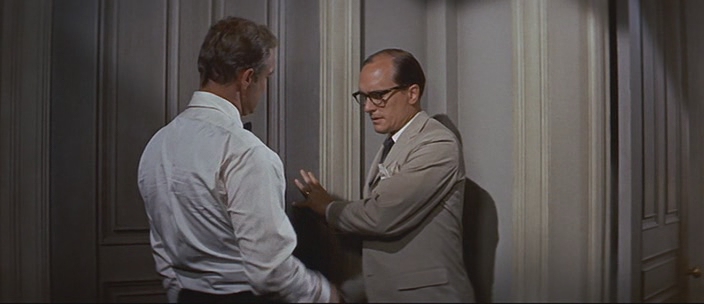
Locate an element on the screen. The height and width of the screenshot is (304, 704). door is located at coordinates (142, 103), (670, 135).